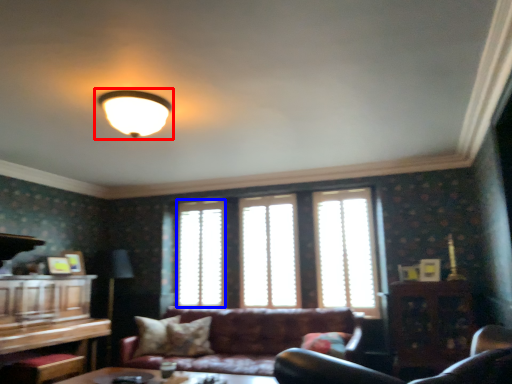
Question: Which object is closer to the camera taking this photo, lamp (highlighted by a red box) or window (highlighted by a blue box)?

Choices:
 (A) lamp
 (B) window

Answer: (A)